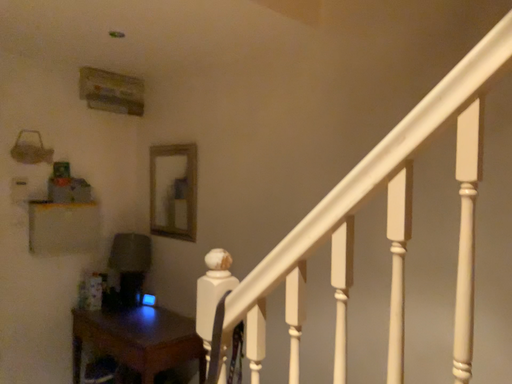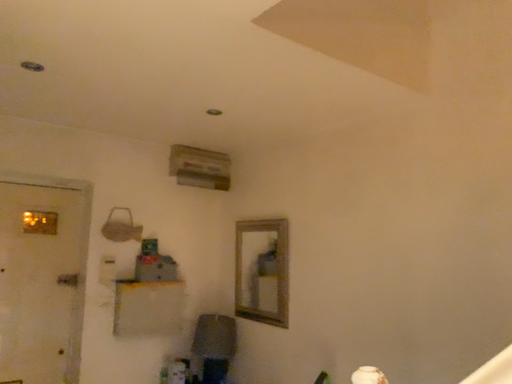
Question: How did the camera likely rotate when shooting the video?

Choices:
 (A) rotated downward
 (B) rotated upward

Answer: (B)